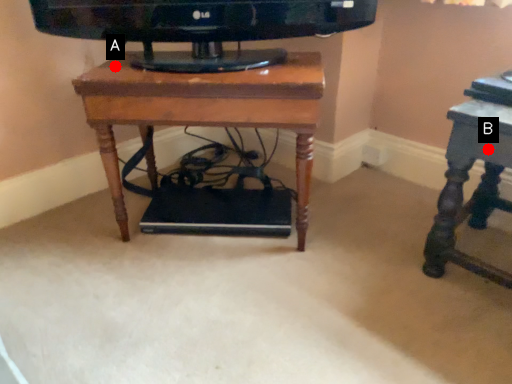
Question: Two points are circled on the image, labeled by A and B beside each circle. Among these points, which one is nearest to the camera?

Choices:
 (A) A is closer
 (B) B is closer

Answer: (B)